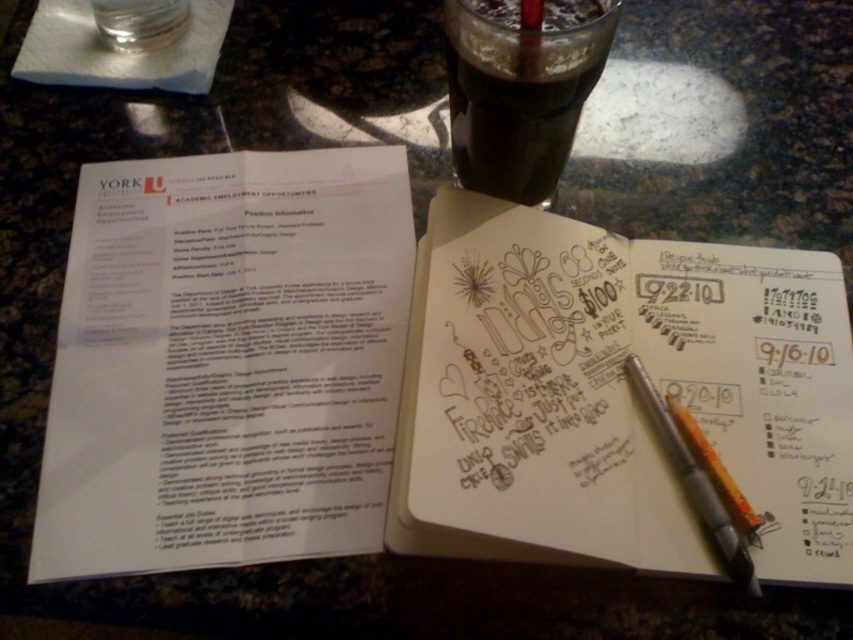
You are organizing your desk and need to place a new item between the white paper at upper left and the silver metallic pen at center. Considering their sizes, which object should be placed closer to the edge of the desk to ensure the new item fits?

The white paper at upper left is taller than the silver metallic pen at center. To ensure the new item fits between them, place the silver metallic pen at center closer to the edge since it is shorter.

You are organizing your desk and need to place a new folder between the white paper at upper left and the brown paper notebook at center. Where should you place it to be between them?

The white paper at upper left is located above the brown paper notebook at center, so placing the new folder between them would require positioning it below the white paper at upper left and above the brown paper notebook at center.

You need to place both the white paper at upper left and the brown paper notebook at center on a shelf. Which one requires more horizontal space?

The brown paper notebook at center requires more horizontal space because it has a greater width than the white paper at upper left.